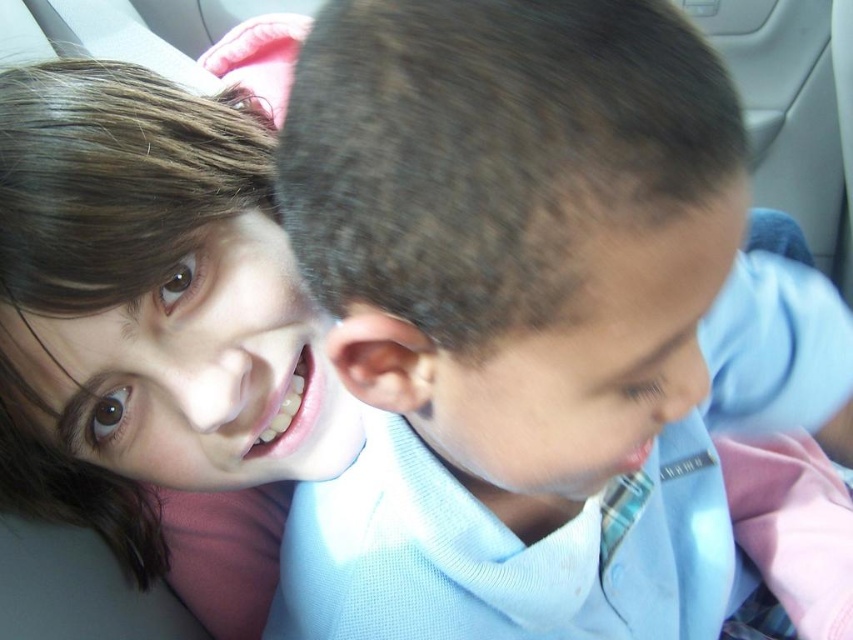
Does light blue shirt at center appear on the left side of smooth skin face at upper left?

In fact, light blue shirt at center is to the right of smooth skin face at upper left.

Is point (689, 266) more distant than point (44, 147)?

No, (689, 266) is in front of (44, 147).

Between point (473, 362) and point (310, 364), which one is positioned behind?

Point (310, 364)

I want to click on light blue shirt at center, so click(535, 321).